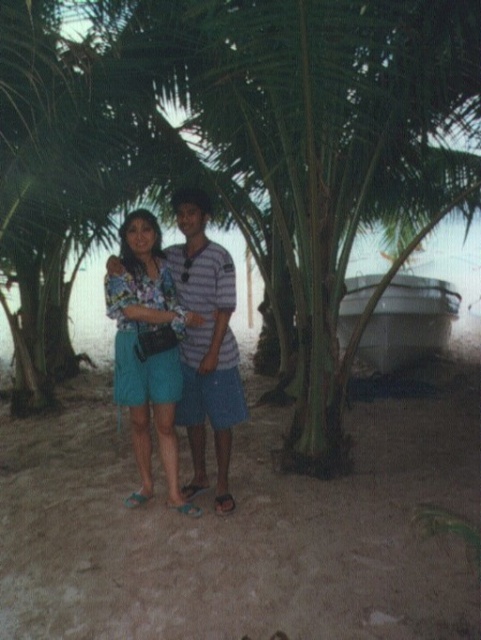
Which is behind, point (184, 573) or point (218, 460)?

Positioned behind is point (218, 460).

Looking at this image, between smooth sand at center and striped shirt at center, which one appears on the left side from the viewer's perspective?

Answer: striped shirt at center

Who is more distant from viewer, [160,612] or [202,230]?

The point [202,230] is behind.

At what (x,y) coordinates should I click in order to perform the action: click on smooth sand at center. Please return your answer as a coordinate pair (x, y). Image resolution: width=481 pixels, height=640 pixels. Looking at the image, I should click on (244, 529).

Can you confirm if matte floral blouse at center is positioned to the left of striped shirt at center?

Correct, you'll find matte floral blouse at center to the left of striped shirt at center.

At what (x,y) coordinates should I click in order to perform the action: click on matte floral blouse at center. Please return your answer as a coordinate pair (x, y). Image resolution: width=481 pixels, height=640 pixels. Looking at the image, I should click on (147, 348).

Consider the image. Who is more forward, (243, 436) or (138, 400)?

Point (138, 400) is in front.

Who is shorter, smooth sand at center or matte floral blouse at center?

Standing shorter between the two is smooth sand at center.

This screenshot has height=640, width=481. What do you see at coordinates (244, 529) in the screenshot?
I see `smooth sand at center` at bounding box center [244, 529].

The width and height of the screenshot is (481, 640). Find the location of `smooth sand at center`. smooth sand at center is located at coordinates (244, 529).